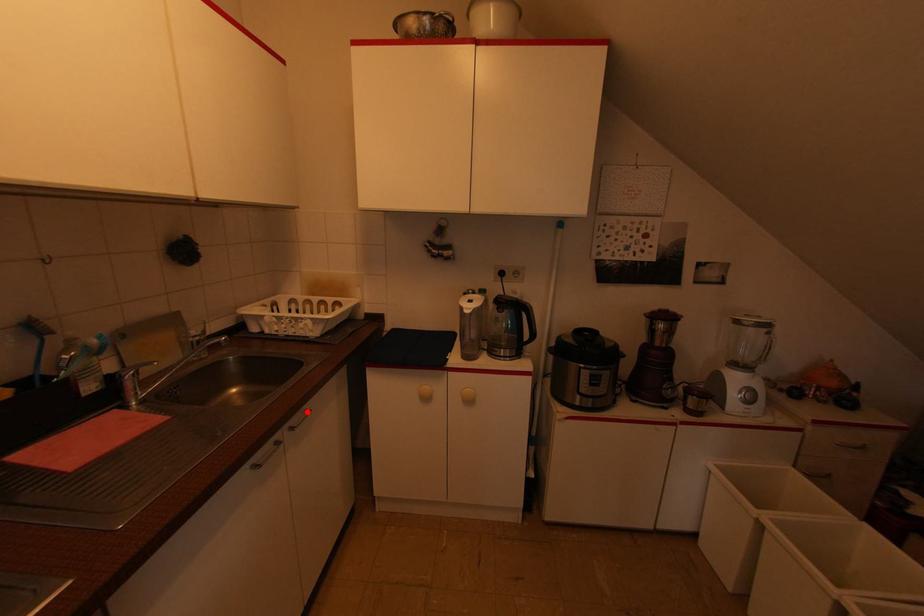
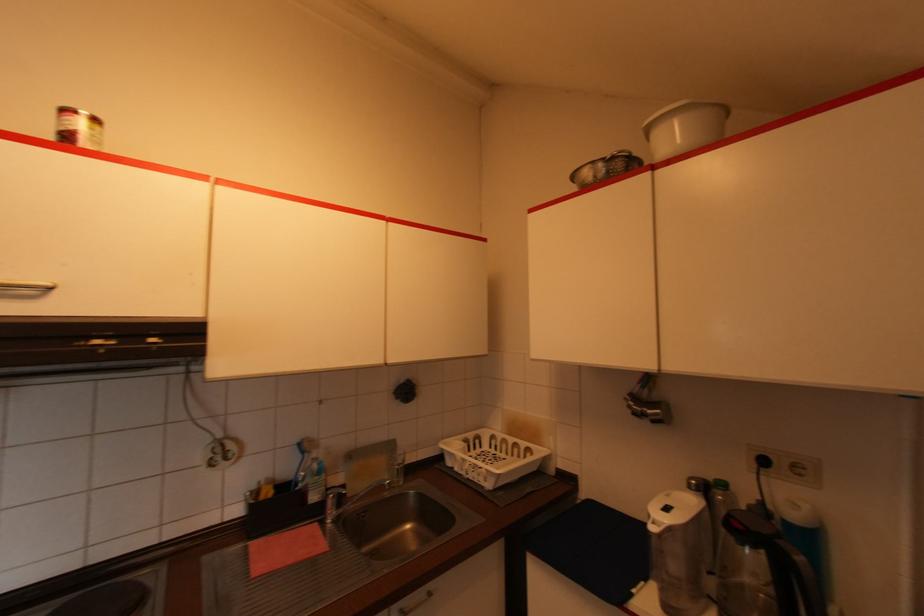
In the second image, find the point that corresponds to the highlighted location in the first image.

(431, 594)